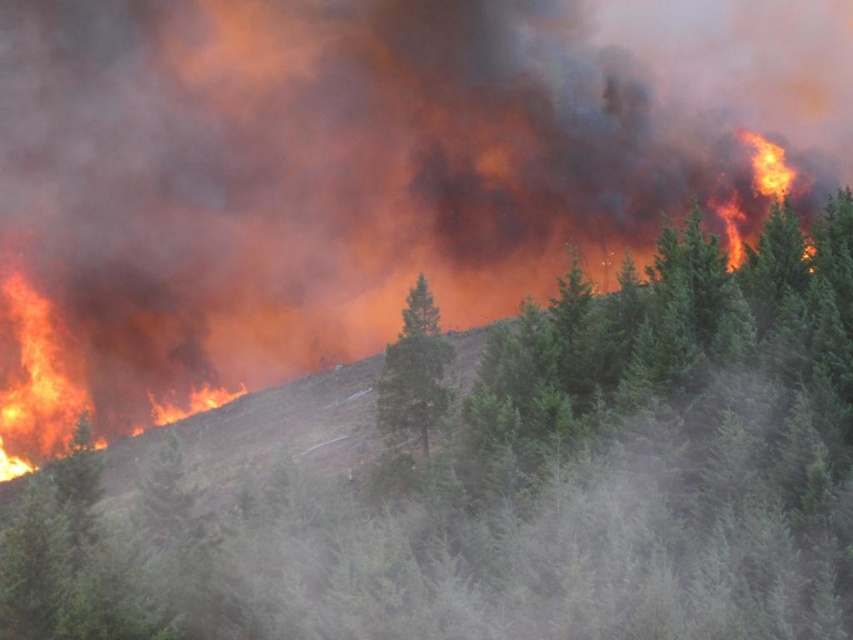
What do you see at coordinates (498, 481) in the screenshot? The image size is (853, 640). I see `green textured tree at center` at bounding box center [498, 481].

Between green textured tree at center and green matte tree at center, which one is positioned higher?

green matte tree at center is higher up.

Locate an element on the screen. The width and height of the screenshot is (853, 640). green textured tree at center is located at coordinates (498, 481).

Identify the location of green textured tree at center. The height and width of the screenshot is (640, 853). (498, 481).